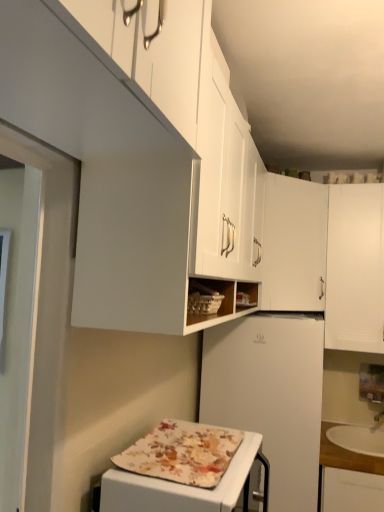
Question: Is white matte cabinet at upper center, the 2th cabinetry positioned from the left, bigger or smaller than white matte cabinet at upper center, which appears as the third cabinetry when viewed from the right?

Choices:
 (A) small
 (B) big

Answer: (A)

Question: From a real-world perspective, is white matte cabinet at upper center, the 2th cabinetry positioned from the left, above or below white matte cabinet at upper center, which appears as the third cabinetry when viewed from the right?

Choices:
 (A) below
 (B) above

Answer: (A)

Question: Based on their relative distances, which object is farther from the white matte refrigerator at center?

Choices:
 (A) white matte cabinet at upper right, which is the 1th cabinetry from right to left
 (B) wooden countertop at lower right
 (C) white matte cabinet at upper center, the 2th cabinetry positioned from the left
 (D) floral fabric-covered appliance at lower center
 (E) white matte cabinet at upper center, placed as the 1th cabinetry when sorted from left to right

Answer: (E)

Question: Which object is positioned closest to the white matte cabinet at upper center, the 2th cabinetry positioned from the left?

Choices:
 (A) floral fabric-covered appliance at lower center
 (B) white matte cabinet at upper right, which is the 1th cabinetry from right to left
 (C) white matte refrigerator at center
 (D) white matte cabinet at upper center, placed as the 1th cabinetry when sorted from left to right
 (E) wooden countertop at lower right

Answer: (B)